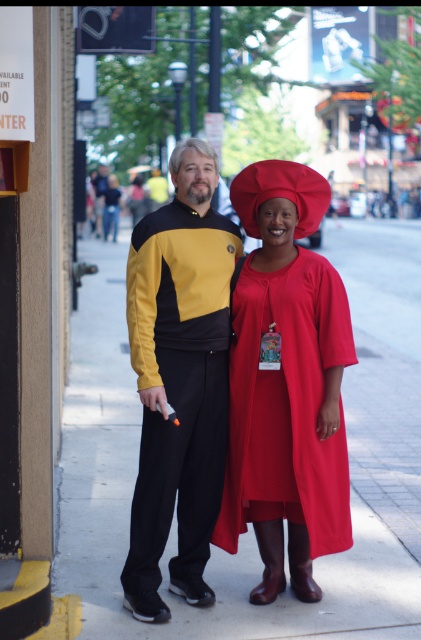
Question: Which object is the closest to the yellow matte uniform at center?

Choices:
 (A) smooth concrete pavement at center
 (B) matte red dress at center

Answer: (B)

Question: Which object is closer to the camera taking this photo?

Choices:
 (A) smooth concrete pavement at center
 (B) matte red dress at center

Answer: (A)

Question: Estimate the real-world distances between objects in this image. Which object is farther from the yellow matte uniform at center?

Choices:
 (A) smooth concrete pavement at center
 (B) matte red dress at center

Answer: (A)

Question: Can you confirm if smooth concrete pavement at center is positioned above matte red dress at center?

Choices:
 (A) no
 (B) yes

Answer: (B)

Question: Is smooth concrete pavement at center thinner than matte red dress at center?

Choices:
 (A) no
 (B) yes

Answer: (A)

Question: Does matte red dress at center have a smaller size compared to yellow matte uniform at center?

Choices:
 (A) yes
 (B) no

Answer: (A)